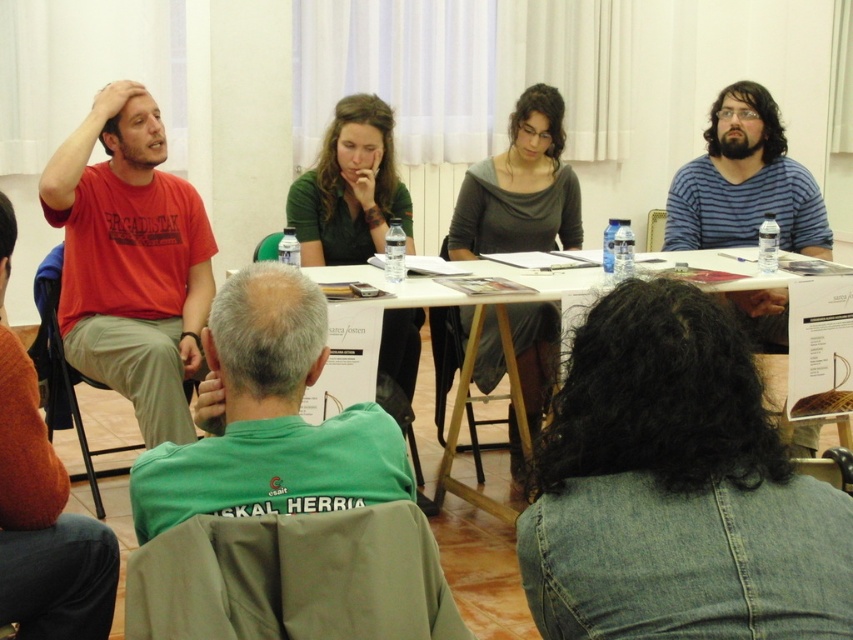
What is located at the coordinates point [131,260]?

At point [131,260] lies matte red shirt at left.

Please provide the exact coordinates of the matte red shirt at left in the image.

The coordinates of the matte red shirt at left are at point (131, 260).

You are a photographer standing at the back of the room. You want to take a photo of the denim jacket at lower right and the matte red shirt at left without any obstruction. Based on their positions, which object is more likely to be visible first in the frame?

The denim jacket at lower right is positioned under the matte red shirt at left, so the matte red shirt at left will be visible first in the frame since it is above the denim jacket at lower right.